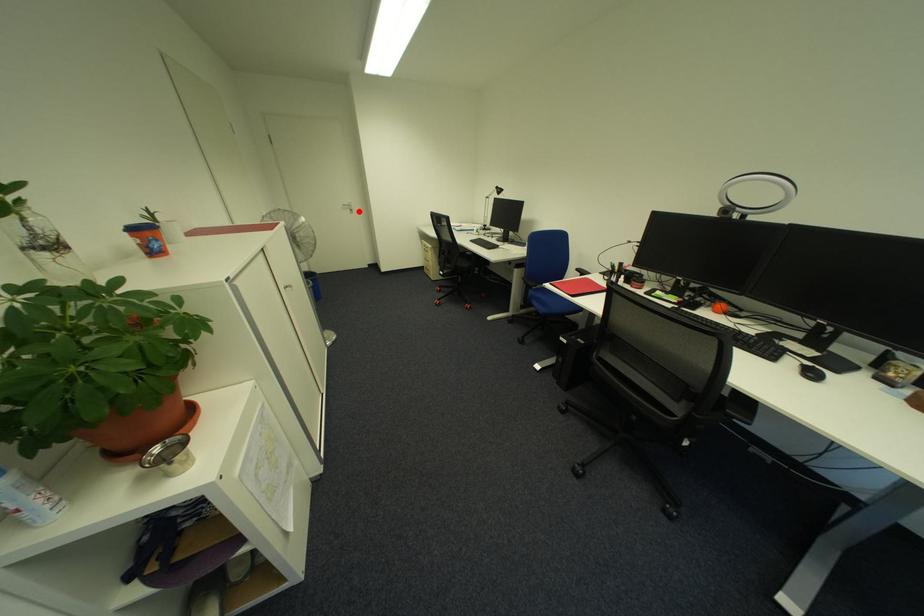
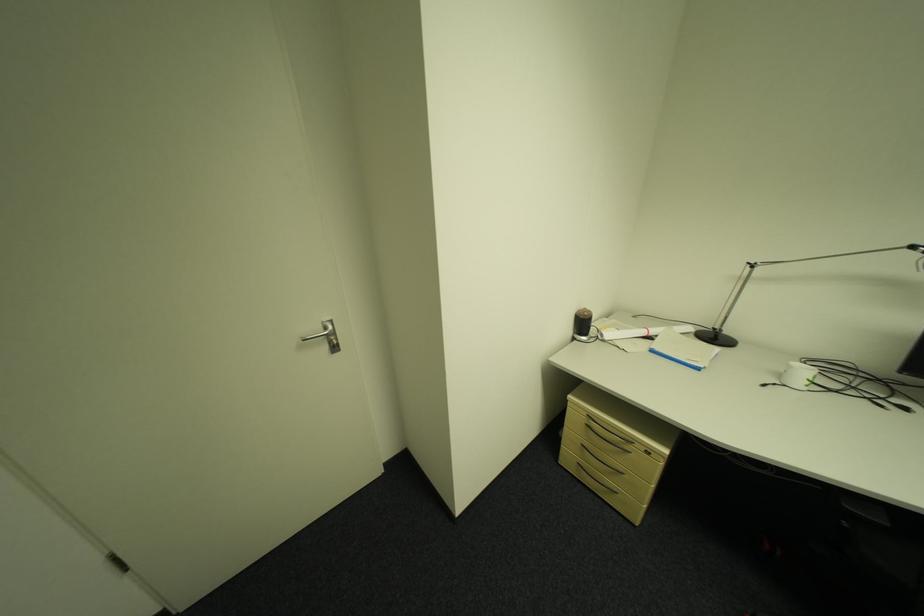
Question: I am providing you with two images of the same scene from different viewpoints. In image1, a red point is highlighted. Considering the same 3D point in image2, which of the following is correct?

Choices:
 (A) It is closer
 (B) It is farther

Answer: (B)